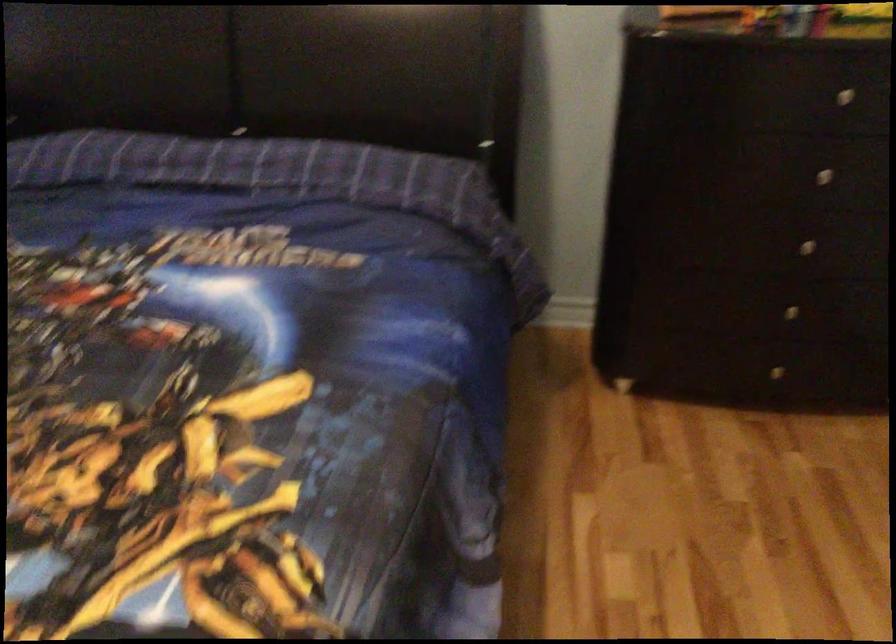
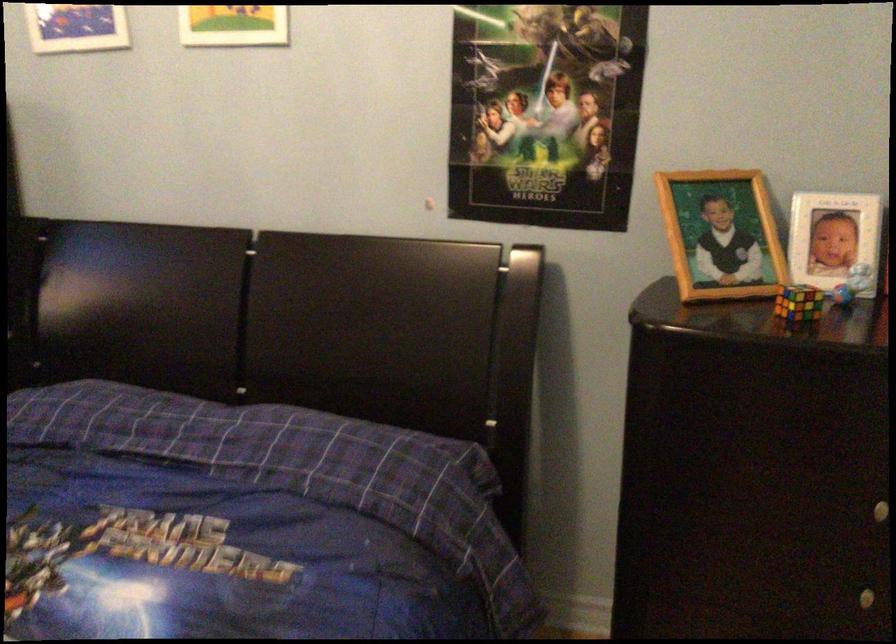
The point at (805, 245) is marked in the first image. Where is the corresponding point in the second image?

(868, 597)